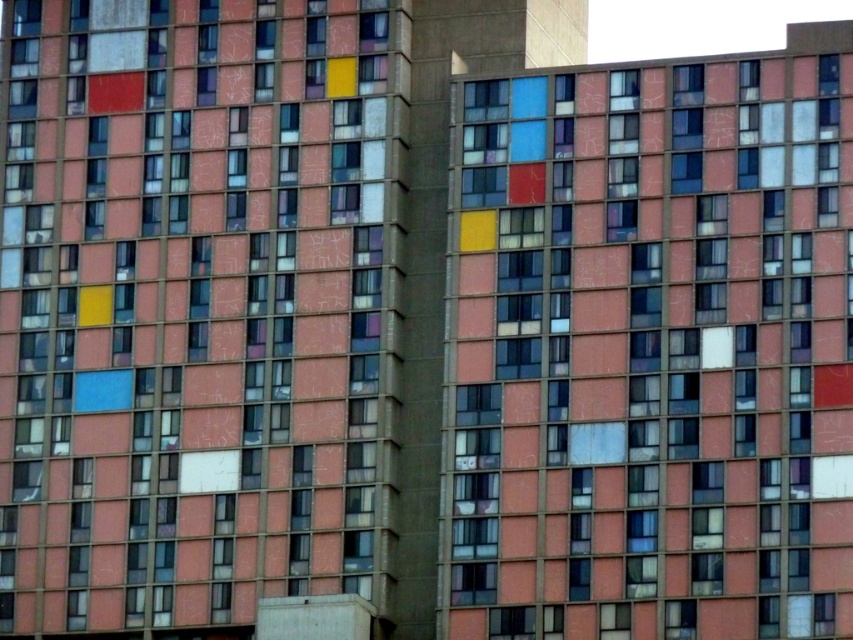
Question: Is matte pink window at center further to camera compared to matte glass window at center?

Choices:
 (A) yes
 (B) no

Answer: (A)

Question: Which point appears farthest from the camera in this image?

Choices:
 (A) (254, 259)
 (B) (598, 230)

Answer: (A)

Question: Does matte pink window at center appear on the left side of matte glass window at center?

Choices:
 (A) no
 (B) yes

Answer: (B)

Question: Which point appears closest to the camera in this image?

Choices:
 (A) coord(811,563)
 (B) coord(381,324)

Answer: (A)

Question: Does matte pink window at center appear under matte glass window at center?

Choices:
 (A) no
 (B) yes

Answer: (A)